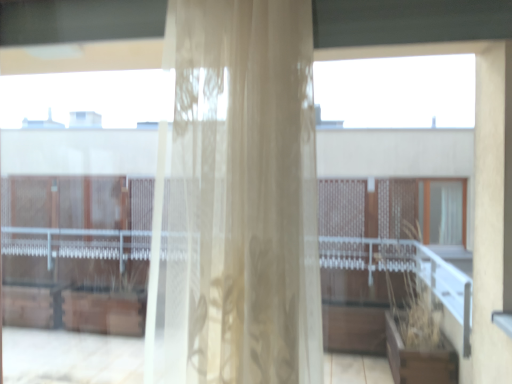
What do you see at coordinates (401, 158) in the screenshot? I see `transparent glass window at upper right` at bounding box center [401, 158].

Where is `transparent glass window at upper right`? The width and height of the screenshot is (512, 384). transparent glass window at upper right is located at coordinates (401, 158).

In order to face translucent floral-patterned curtain at center, should I rotate leftwards or rightwards?

Rotate left and turn 2.663 degrees.

The width and height of the screenshot is (512, 384). Find the location of `translucent floral-patterned curtain at center`. translucent floral-patterned curtain at center is located at coordinates (243, 196).

This screenshot has height=384, width=512. Describe the element at coordinates (243, 196) in the screenshot. I see `translucent floral-patterned curtain at center` at that location.

At what (x,y) coordinates should I click in order to perform the action: click on transparent glass window at upper right. Please return your answer as a coordinate pair (x, y). Looking at the image, I should click on (401, 158).

Between translucent floral-patterned curtain at center and transparent glass window at upper right, which one appears on the left side from the viewer's perspective?

Positioned to the left is translucent floral-patterned curtain at center.

Considering the relative positions of translucent floral-patterned curtain at center and transparent glass window at upper right in the image provided, is translucent floral-patterned curtain at center behind transparent glass window at upper right?

No, the depth of translucent floral-patterned curtain at center is less than that of transparent glass window at upper right.

Does point (252, 324) lie in front of point (446, 147)?

Yes, point (252, 324) is closer to viewer.

From the image's perspective, would you say translucent floral-patterned curtain at center is shown under transparent glass window at upper right?

No, from the image's perspective, translucent floral-patterned curtain at center is not beneath transparent glass window at upper right.

From a real-world perspective, is translucent floral-patterned curtain at center located higher than transparent glass window at upper right?

Indeed, from a real-world perspective, translucent floral-patterned curtain at center stands above transparent glass window at upper right.

Consider the image. Which of these two, translucent floral-patterned curtain at center or transparent glass window at upper right, is wider?

With larger width is translucent floral-patterned curtain at center.

Considering the sizes of objects translucent floral-patterned curtain at center and transparent glass window at upper right in the image provided, who is shorter, translucent floral-patterned curtain at center or transparent glass window at upper right?

With less height is transparent glass window at upper right.

In the scene shown: Considering the sizes of translucent floral-patterned curtain at center and transparent glass window at upper right in the image, is translucent floral-patterned curtain at center bigger or smaller than transparent glass window at upper right?

In the image, translucent floral-patterned curtain at center appears to be larger than transparent glass window at upper right.

Based on the photo, is translucent floral-patterned curtain at center outside of transparent glass window at upper right?

Yes, translucent floral-patterned curtain at center is outside of transparent glass window at upper right.

Is there a large distance between translucent floral-patterned curtain at center and transparent glass window at upper right?

No, translucent floral-patterned curtain at center is not far from transparent glass window at upper right.

Is translucent floral-patterned curtain at center positioned with its back to transparent glass window at upper right?

No, translucent floral-patterned curtain at center's orientation is not away from transparent glass window at upper right.

How distant is translucent floral-patterned curtain at center from transparent glass window at upper right?

translucent floral-patterned curtain at center is 18.91 inches from transparent glass window at upper right.

This screenshot has height=384, width=512. Identify the location of curtain lying on the left of transparent glass window at upper right. (243, 196).

Which object is positioned more to the left, transparent glass window at upper right or translucent floral-patterned curtain at center?

From the viewer's perspective, translucent floral-patterned curtain at center appears more on the left side.

Which is in front, transparent glass window at upper right or translucent floral-patterned curtain at center?

Positioned in front is translucent floral-patterned curtain at center.

Considering the points (423, 56) and (271, 289), which point is in front, point (423, 56) or point (271, 289)?

The point (271, 289) is closer.

From the image's perspective, relative to translucent floral-patterned curtain at center, is transparent glass window at upper right above or below?

transparent glass window at upper right is situated lower than translucent floral-patterned curtain at center in the image.

From a real-world perspective, who is located higher, transparent glass window at upper right or translucent floral-patterned curtain at center?

translucent floral-patterned curtain at center.

Considering the sizes of transparent glass window at upper right and translucent floral-patterned curtain at center in the image, is transparent glass window at upper right wider or thinner than translucent floral-patterned curtain at center?

transparent glass window at upper right is thinner than translucent floral-patterned curtain at center.

In terms of height, does transparent glass window at upper right look taller or shorter compared to translucent floral-patterned curtain at center?

In the image, transparent glass window at upper right appears to be shorter than translucent floral-patterned curtain at center.

Is transparent glass window at upper right bigger than translucent floral-patterned curtain at center?

Actually, transparent glass window at upper right might be smaller than translucent floral-patterned curtain at center.

Is transparent glass window at upper right inside or outside of translucent floral-patterned curtain at center?

transparent glass window at upper right lies outside translucent floral-patterned curtain at center.

Is transparent glass window at upper right not near translucent floral-patterned curtain at center?

No, transparent glass window at upper right is not far away from translucent floral-patterned curtain at center.

Is translucent floral-patterned curtain at center at the back of transparent glass window at upper right?

No, transparent glass window at upper right is not facing away from translucent floral-patterned curtain at center.

In the scene shown: Measure the distance between transparent glass window at upper right and translucent floral-patterned curtain at center.

transparent glass window at upper right is 48.02 centimeters from translucent floral-patterned curtain at center.

Locate an element on the screen. curtain lying above the transparent glass window at upper right (from the image's perspective) is located at coordinates (243, 196).

You are a GUI agent. You are given a task and a screenshot of the screen. Output one action in this format:
    pyautogui.click(x=<x>, y=<y>)
    Task: Click on the curtain to the left of transparent glass window at upper right
    The image size is (512, 384).
    Given the screenshot: What is the action you would take?
    pyautogui.click(x=243, y=196)

Locate an element on the screen. The image size is (512, 384). curtain in front of the transparent glass window at upper right is located at coordinates (243, 196).